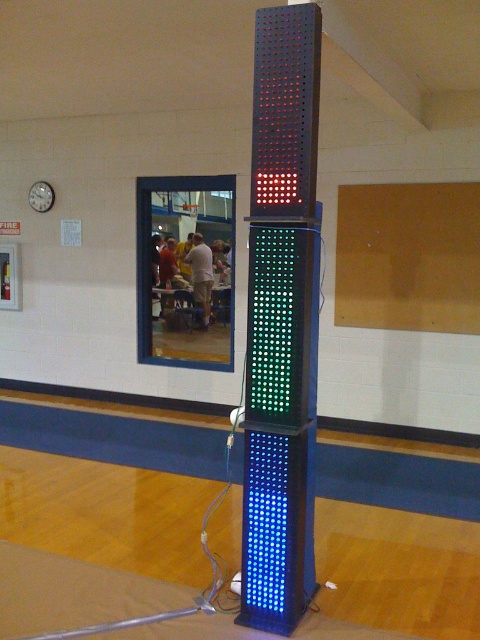
Based on the photo, you are an event planner setting up for a party in this gymnasium. You need to hang a banner between the multicolored led display at center and the metallic wall clock at upper left. Which object is lower so you know where to place the banner?

The multicolored led display at center is located below the metallic wall clock at upper left, so the banner should be placed between them with the lower end near the multicolored led display at center and the higher end near the metallic wall clock at upper left.

You are standing in the gymnasium and want to take a photo of the multicolored led display at center. The camera you are using has a minimum focus distance of 2 meters. Can you capture a clear photo without moving closer?

The distance between you and the multicolored led display at center is 2.54 meters, which is greater than the camera minimum focus distance of 2 meters. Therefore, you can capture a clear photo without moving closer.

You are standing in the gymnasium and want to check the time on the metallic wall clock at upper left. However, there is a multicolored led display at center blocking your view. Can you see the clock clearly from your current position?

The multicolored led display at center is closer to the viewer than the metallic wall clock at upper left, so the display is blocking the view of the clock. You cannot see the clock clearly from your current position.